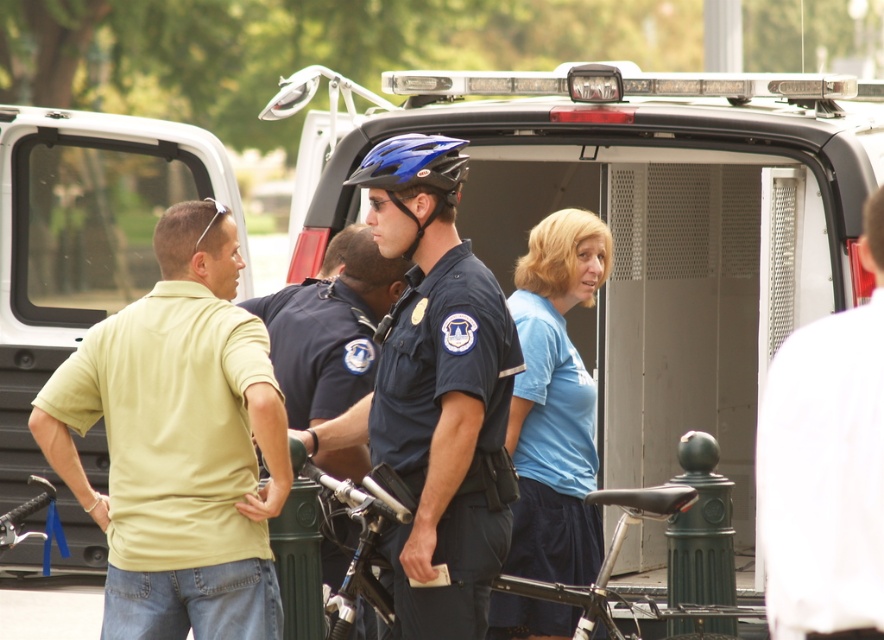
You are a pedestrian standing at the edge of the scene. You see the metallic silver van at center and the white matte shirt at upper right. Which object is closer to your left side?

The metallic silver van at center is closer to your left side because it is positioned to the left of the white matte shirt at upper right.

You are a witness describing the scene to a colleague. You see the white matte shirt at upper right and the light yellow shirt at center. Which one is positioned more to the right side of the scene?

The white matte shirt at upper right is positioned more to the right side of the scene compared to the light yellow shirt at center.